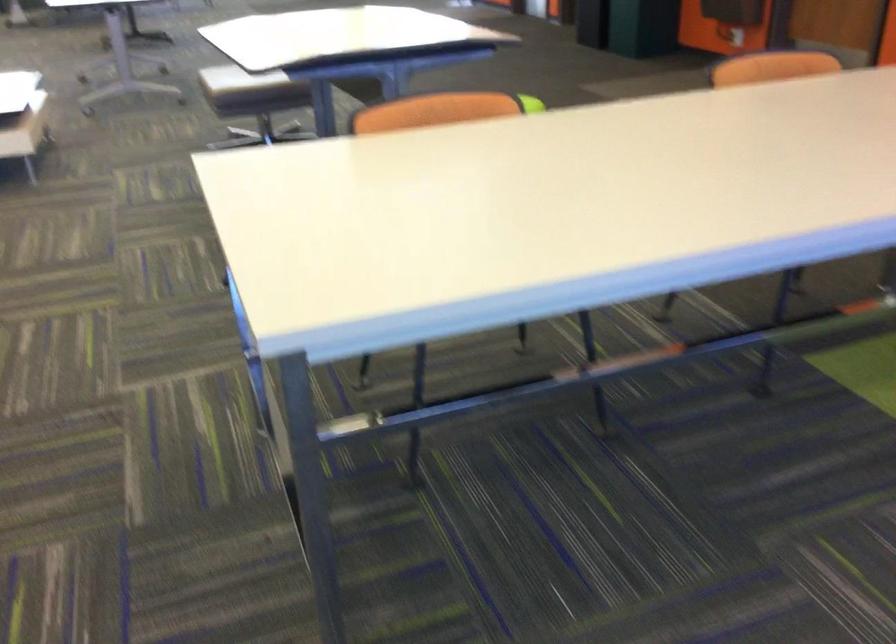
The width and height of the screenshot is (896, 644). Describe the element at coordinates (492, 189) in the screenshot. I see `the chair sitting surface` at that location.